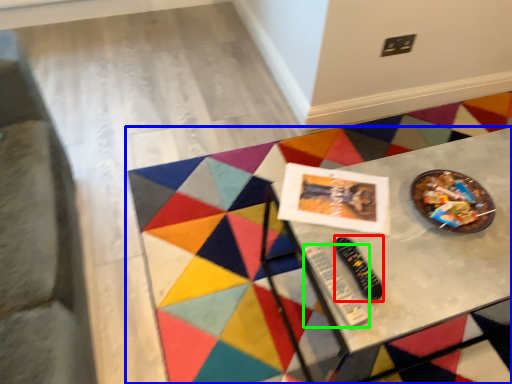
Question: Which is nearer to the control (highlighted by a red box)? table (highlighted by a blue box) or control (highlighted by a green box).

Choices:
 (A) table
 (B) control

Answer: (B)